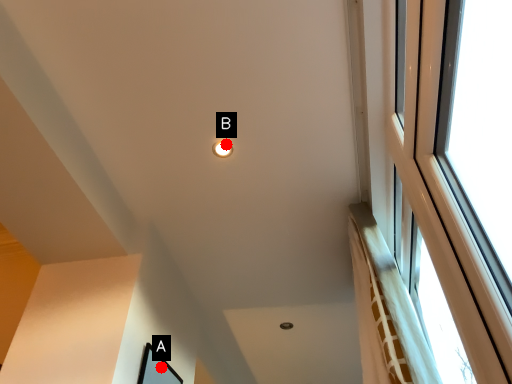
Question: Two points are circled on the image, labeled by A and B beside each circle. Among these points, which one is farthest from the camera?

Choices:
 (A) A is further
 (B) B is further

Answer: (A)